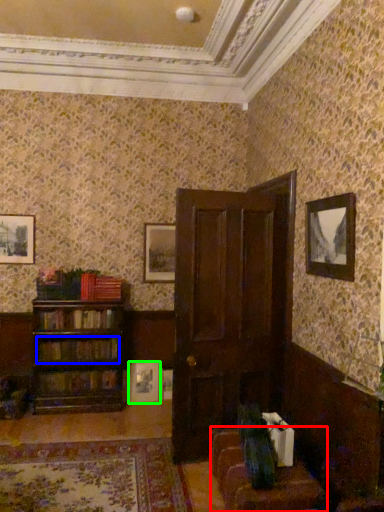
Question: Based on their relative distances, which object is farther from couch (highlighted by a red box)? Choose from book (highlighted by a blue box) and picture frame (highlighted by a green box).

Choices:
 (A) book
 (B) picture frame

Answer: (A)